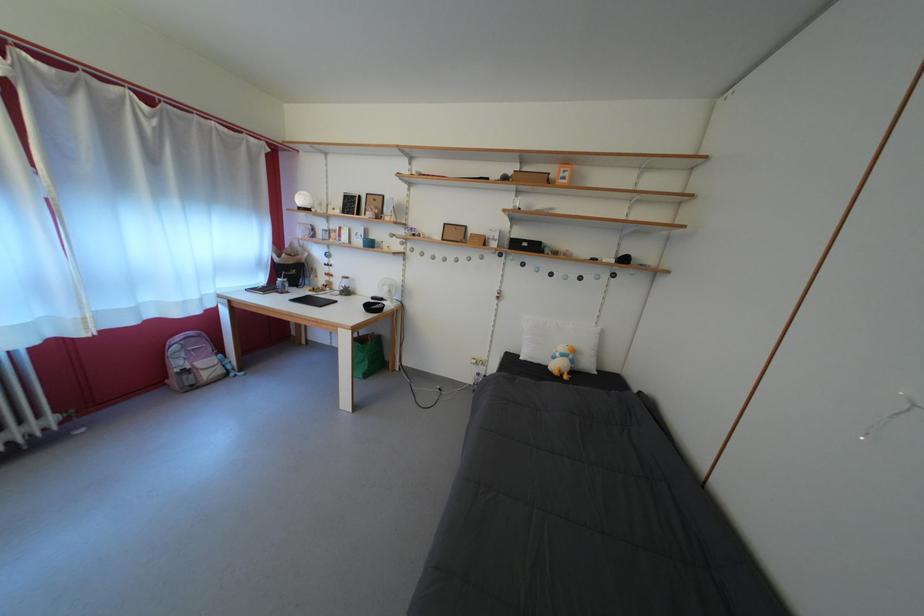
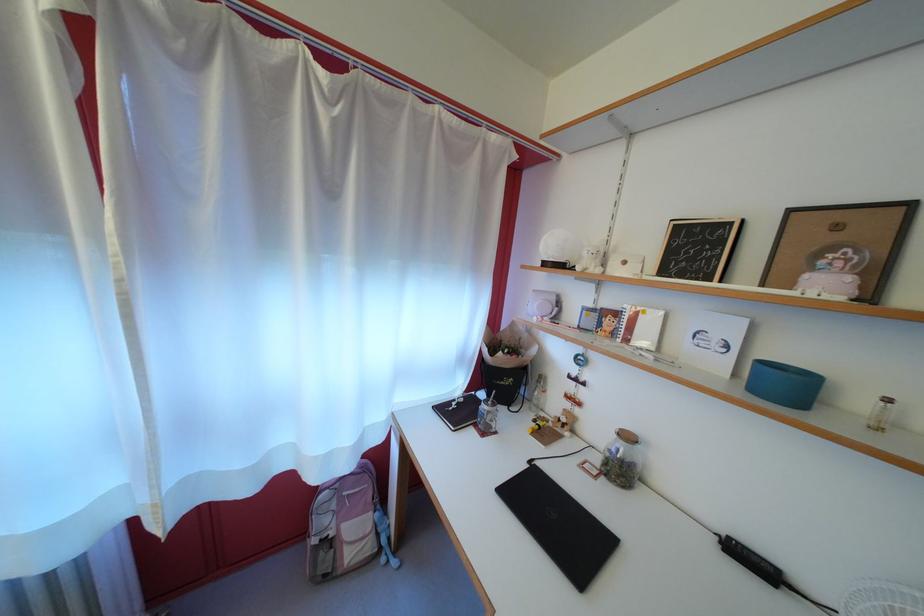
The point at (x=162, y=164) is marked in the first image. Where is the corresponding point in the second image?

(335, 193)